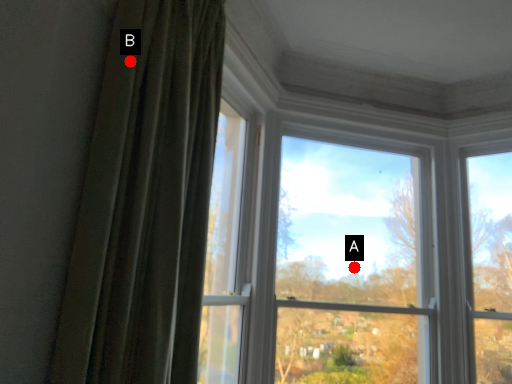
Question: Two points are circled on the image, labeled by A and B beside each circle. Which point is closer to the camera taking this photo?

Choices:
 (A) A is closer
 (B) B is closer

Answer: (B)